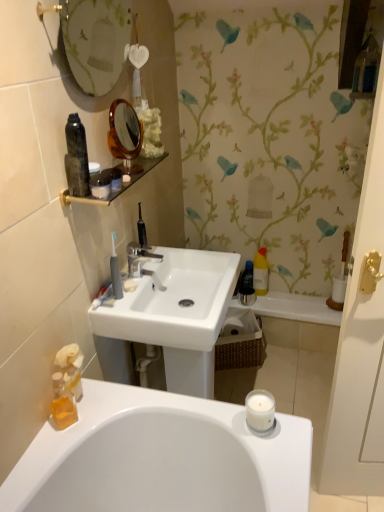
Question: Based on their sizes in the image, would you say white matte soap at upper center is bigger or smaller than white plastic toothbrush at left?

Choices:
 (A) small
 (B) big

Answer: (A)

Question: From the image's perspective, is white matte soap at upper center above or below white plastic toothbrush at left?

Choices:
 (A) above
 (B) below

Answer: (A)

Question: Which is nearer to the yellow translucent bottle at right, the 2th bottle viewed from the back?

Choices:
 (A) matte black jar at upper center, acting as the second toiletry starting from the left
 (B) matte black shelf at upper left
 (C) translucent orange soap at lower left, acting as the first toiletry starting from the bottom
 (D) black plastic toothbrush at upper center, which appears as the 2th toiletries when viewed from the front
 (E) white plastic toothbrush at left

Answer: (D)

Question: Which of these objects is positioned farthest from the white ceramic faucet at center?

Choices:
 (A) gray plastic toothbrush at center, arranged as the first toiletries when viewed from the left
 (B) yellow translucent bottle at right, which ranks as the first bottle in back-to-front order
 (C) woven brown picnic basket at lower center
 (D) translucent amber liquid at sink left, arranged as the first bottle when ordered from the bottom
 (E) white plastic toothbrush at left

Answer: (B)